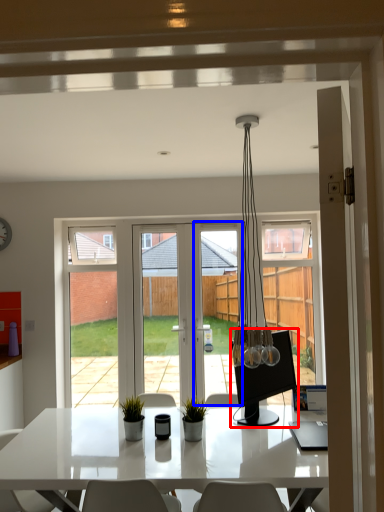
Question: Which of the following is the farthest to the observer, computer monitor (highlighted by a red box) or screen door (highlighted by a blue box)?

Choices:
 (A) computer monitor
 (B) screen door

Answer: (B)